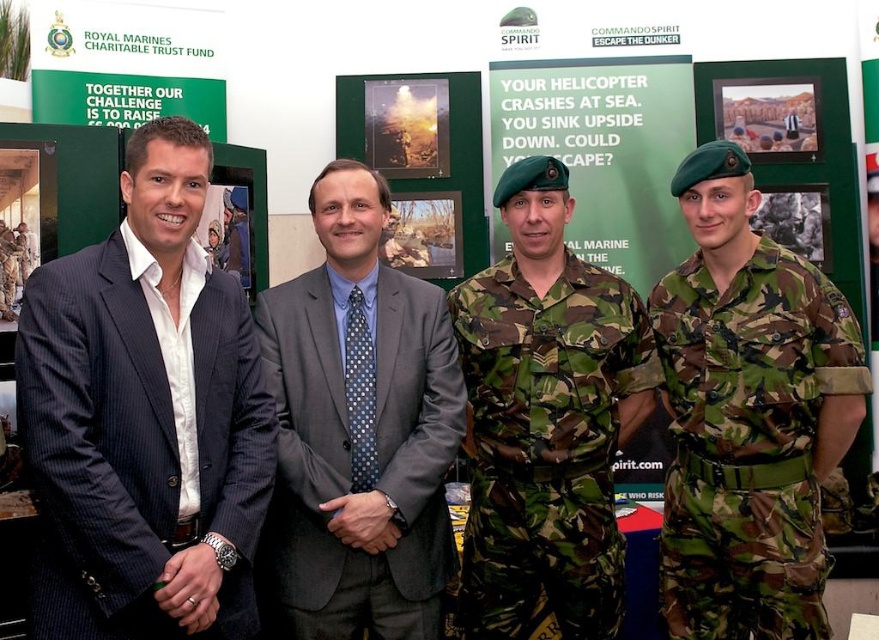
Between dark blue pinstripe suit at left and gray suit at center, which one appears on the left side from the viewer's perspective?

Positioned to the left is dark blue pinstripe suit at left.

Is dark blue pinstripe suit at left wider than gray suit at center?

No.

Describe the element at coordinates (144, 419) in the screenshot. The image size is (879, 640). I see `dark blue pinstripe suit at left` at that location.

At what (x,y) coordinates should I click in order to perform the action: click on dark blue pinstripe suit at left. Please return your answer as a coordinate pair (x, y). This screenshot has width=879, height=640. Looking at the image, I should click on (x=144, y=419).

Consider the image. Can you confirm if gray suit at center is positioned to the left of camouflage fabric uniform at center?

Indeed, gray suit at center is positioned on the left side of camouflage fabric uniform at center.

Is gray suit at center positioned behind camouflage fabric uniform at center?

No, it is not.

Between point (354, 321) and point (572, 586), which one is positioned behind?

The point (354, 321) is behind.

Identify the location of gray suit at center. 360,429.

Looking at this image, does camouflage uniform at right have a lesser height compared to green camouflage poster at center?

In fact, camouflage uniform at right may be taller than green camouflage poster at center.

Is camouflage uniform at right bigger than green camouflage poster at center?

Indeed, camouflage uniform at right has a larger size compared to green camouflage poster at center.

Is point (819, 564) positioned before point (659, 195)?

Yes, point (819, 564) is in front of point (659, 195).

Locate an element on the screen. Image resolution: width=879 pixels, height=640 pixels. camouflage uniform at right is located at coordinates pos(747,413).